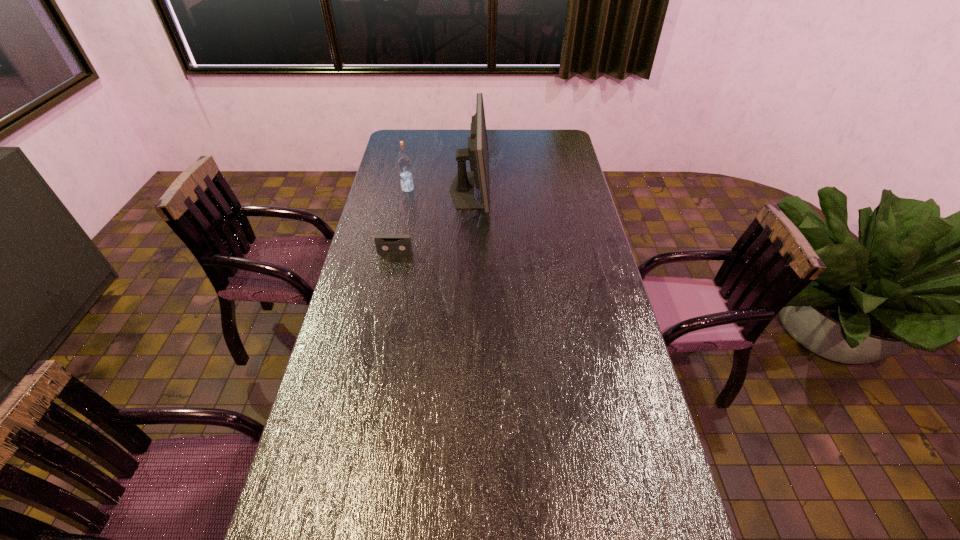
Identify the location of object that is the second closest to the rightmost object. The width and height of the screenshot is (960, 540). (385, 243).

Identify the location of vacant region that satisfies the following two spatial constraints: 1. on the screen side of the tallest object; 2. on the front-facing side of the nearest object. This screenshot has width=960, height=540. (468, 252).

Find the location of a particular element. This screenshot has width=960, height=540. blank area in the image that satisfies the following two spatial constraints: 1. on the screen side of the tallest object; 2. on the front-facing side of the shortest object is located at coordinates (468, 252).